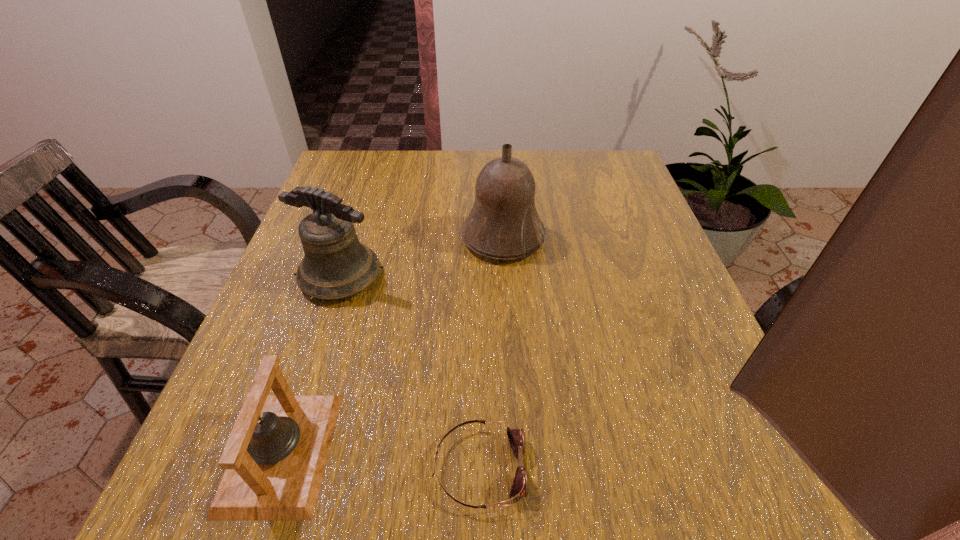
Find the location of `free space between the rightmost bell and the shortest bell`. free space between the rightmost bell and the shortest bell is located at coordinates (393, 345).

Find the location of a particular element. The image size is (960, 540). vacant area that lies between the third tallest object and the rightmost bell is located at coordinates (393, 345).

Where is `unoccupied position between the goggles and the shortest bell`? This screenshot has width=960, height=540. unoccupied position between the goggles and the shortest bell is located at coordinates (381, 460).

This screenshot has width=960, height=540. Identify the location of the closest object to the rightmost bell. click(x=336, y=265).

Image resolution: width=960 pixels, height=540 pixels. In order to click on object that is the third closest to the rightmost bell in this screenshot , I will do `click(520, 487)`.

At what (x,y) coordinates should I click in order to perform the action: click on the closest bell to the rightmost bell. Please return your answer as a coordinate pair (x, y). Looking at the image, I should click on (336, 265).

Find the location of `bell that is the second closest one to the goggles`. bell that is the second closest one to the goggles is located at coordinates (336, 265).

Image resolution: width=960 pixels, height=540 pixels. What are the coordinates of `vacant space that satisfies the following two spatial constraints: 1. on the front side of the rightmost bell; 2. through the lenses of the goggles` in the screenshot? It's located at (516, 468).

Find the location of a particular element. free space that satisfies the following two spatial constraints: 1. on the back side of the rightmost bell; 2. on the left side of the shortest bell is located at coordinates (352, 238).